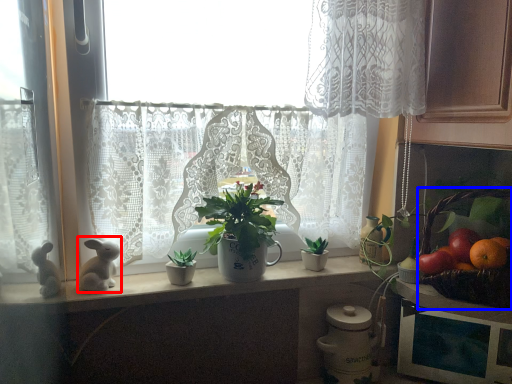
Question: Which object is further to the camera taking this photo, animal (highlighted by a red box) or basket (highlighted by a blue box)?

Choices:
 (A) animal
 (B) basket

Answer: (A)